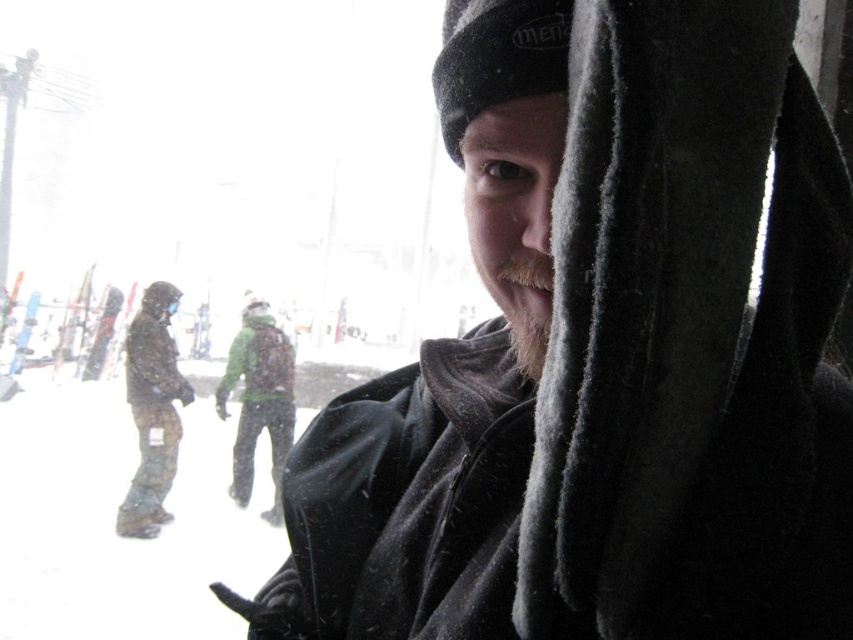
You are a photographer trying to capture a clear shot of the person in the green fabric jacket at center. However, there is a fuzzy black scarf at center in the way. Can you adjust your position to see the jacket without the scarf blocking it?

The fuzzy black scarf at center is closer to the viewer than the green fabric jacket at center, so moving your position slightly to the side might allow you to see the green fabric jacket at center without the scarf blocking it.

Consider the image. You are a photographer trying to capture a clear shot of the person in the foreground. The fuzzy black scarf at center and the green fabric jacket at center are blocking your view. Which object should you move to get a clearer view of the person?

The fuzzy black scarf at center is located above the green fabric jacket at center. To get a clearer view of the person, you should move the fuzzy black scarf at center since it is positioned higher and might be obscuring the face or upper part of the person.